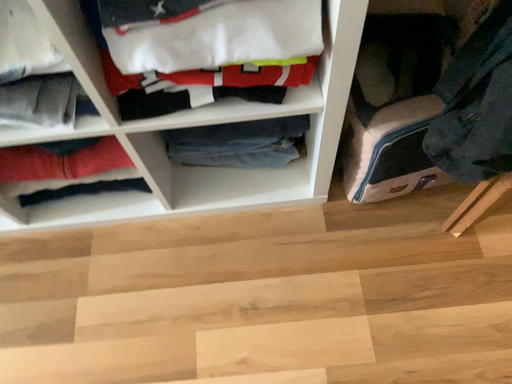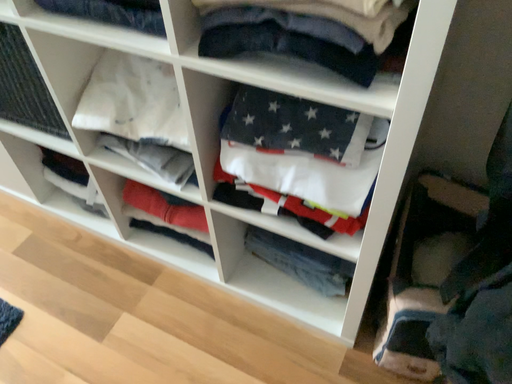
Question: Which way did the camera rotate in the video?

Choices:
 (A) rotated left
 (B) rotated right

Answer: (A)